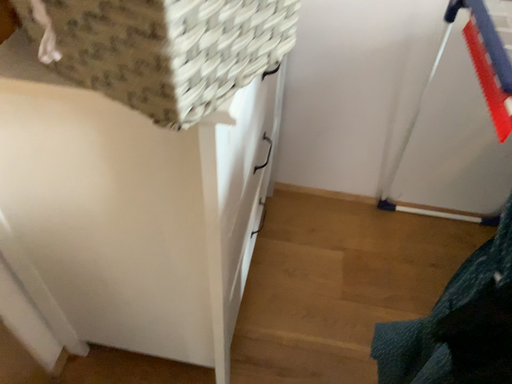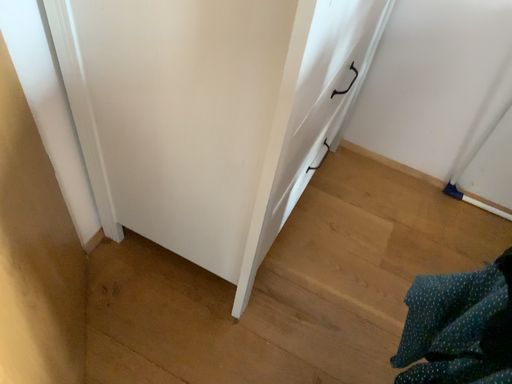
Question: How did the camera likely rotate when shooting the video?

Choices:
 (A) rotated left
 (B) rotated right

Answer: (A)